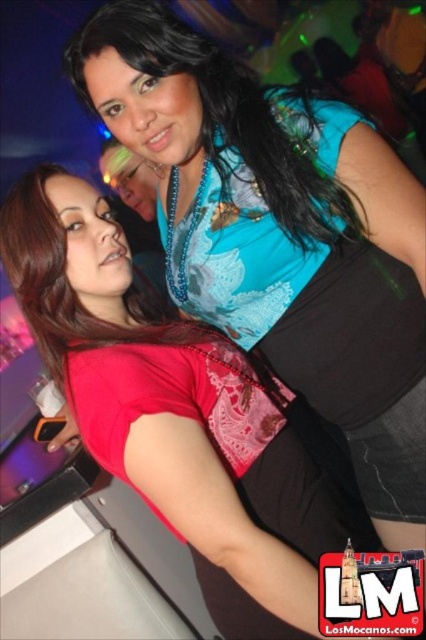
Is matte blue blouse at upper center shorter than matte red shirt at upper left?

Incorrect, matte blue blouse at upper center's height does not fall short of matte red shirt at upper left's.

Can you confirm if matte blue blouse at upper center is thinner than matte red shirt at upper left?

No.

This screenshot has width=426, height=640. Find the location of `matte blue blouse at upper center`. matte blue blouse at upper center is located at coordinates (281, 234).